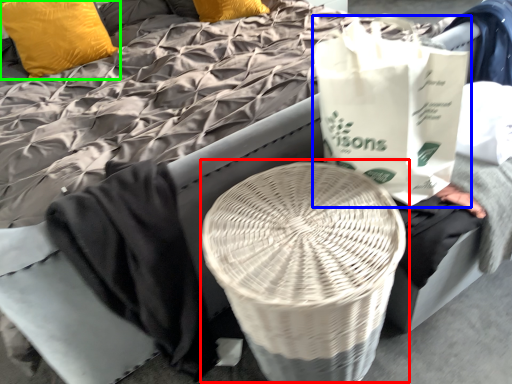
Question: Based on their relative distances, which object is nearer to round table (highlighted by a red box)? Choose from grocery bag (highlighted by a blue box) and pillow (highlighted by a green box).

Choices:
 (A) grocery bag
 (B) pillow

Answer: (A)